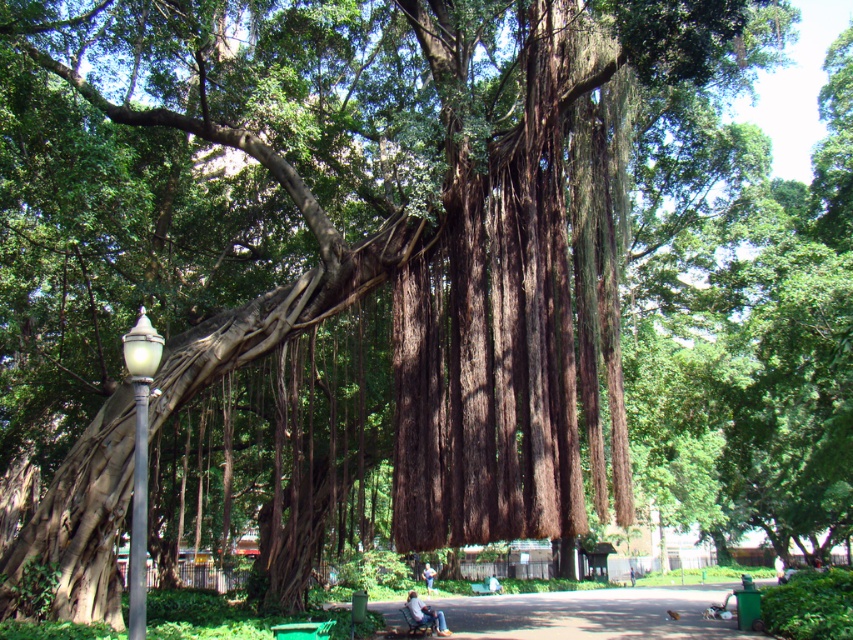
Question: Considering the relative positions of smooth concrete path at lower center and denim jeans at lower center in the image provided, where is smooth concrete path at lower center located with respect to denim jeans at lower center?

Choices:
 (A) above
 (B) below

Answer: (B)

Question: Is denim jeans at lower center bigger than light blue denim jeans at lower center?

Choices:
 (A) yes
 (B) no

Answer: (A)

Question: Which object is closer to the camera taking this photo?

Choices:
 (A) denim jeans at lower center
 (B) smooth concrete path at lower center
 (C) light blue denim jeans at lower center

Answer: (B)

Question: Considering the relative positions of matte black lamp post at left and light blue denim jeans at lower center in the image provided, where is matte black lamp post at left located with respect to light blue denim jeans at lower center?

Choices:
 (A) below
 (B) above

Answer: (B)

Question: Which object is positioned farthest from the light blue denim jeans at lower center?

Choices:
 (A) denim jeans at lower center
 (B) smooth concrete path at lower center
 (C) matte black lamp post at left

Answer: (C)

Question: Which of the following is the closest to the observer?

Choices:
 (A) (677, 621)
 (B) (439, 632)

Answer: (B)